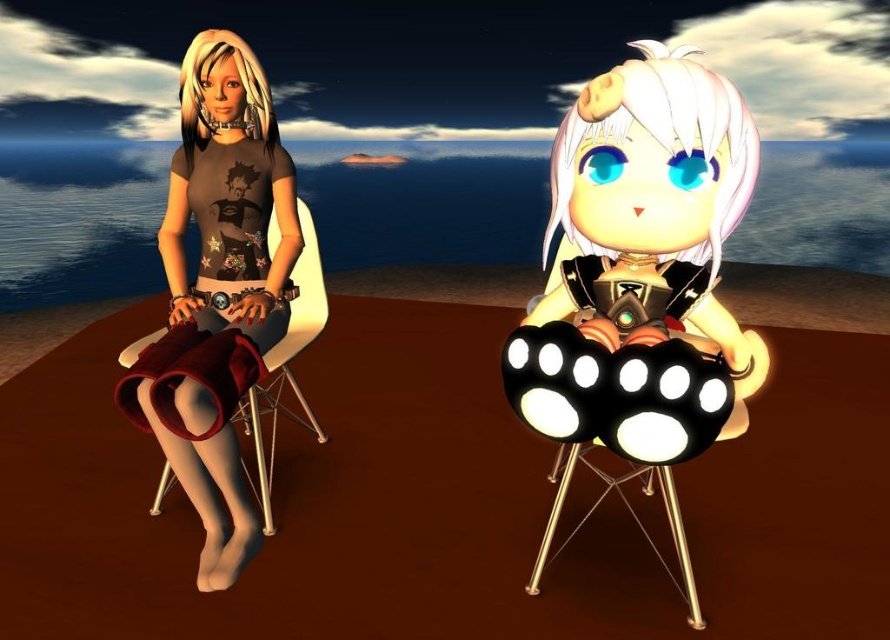
Question: Which point is farther to the camera?

Choices:
 (A) metallic gold stool at right
 (B) shiny black paw pads at center
 (C) white plastic chair at left

Answer: (C)

Question: From the image, what is the correct spatial relationship of shiny black paw pads at center in relation to white plastic chair at left?

Choices:
 (A) right
 (B) left

Answer: (A)

Question: Does white plastic chair at left have a greater width compared to metallic gold stool at right?

Choices:
 (A) no
 (B) yes

Answer: (A)

Question: Which object is positioned closest to the shiny black paw pads at center?

Choices:
 (A) metallic gold stool at right
 (B) white plastic chair at left

Answer: (A)

Question: Does shiny black paw pads at center have a greater width compared to white plastic chair at left?

Choices:
 (A) no
 (B) yes

Answer: (B)

Question: Which point is farther to the camera?

Choices:
 (A) metallic gold stool at right
 (B) white plastic chair at left

Answer: (B)